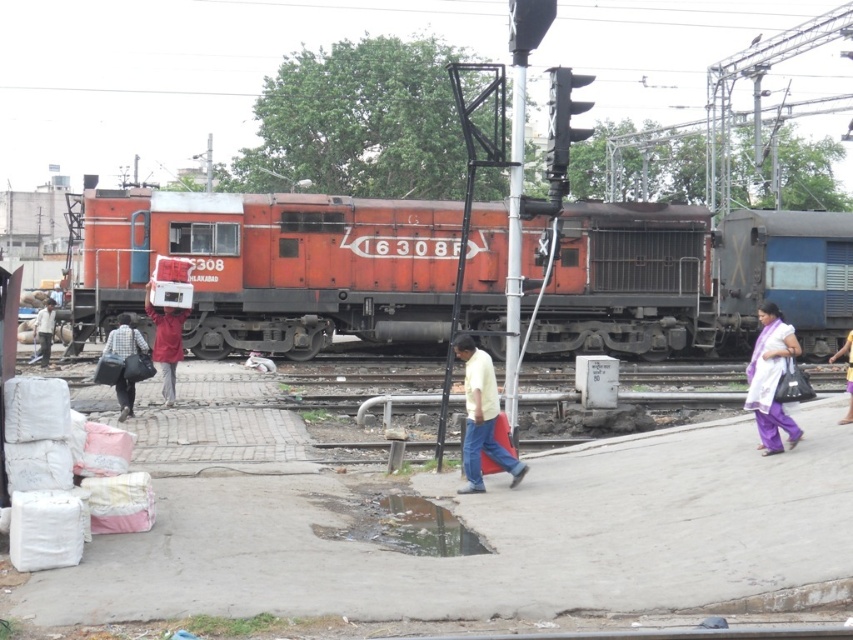
Is the position of light brown fabric bag at left more distant than that of purple fabric at lower right?

Yes.

Does point (51, 324) come farther from viewer compared to point (851, 396)?

Yes, it is.

Is point (44, 353) more distant than point (851, 358)?

Yes.

At what (x,y) coordinates should I click in order to perform the action: click on light brown fabric bag at left. Please return your answer as a coordinate pair (x, y). The image size is (853, 640). Looking at the image, I should click on (44, 332).

Who is positioned more to the left, yellow matte shirt at center or matte red jacket at center?

matte red jacket at center is more to the left.

Does yellow matte shirt at center come behind matte red jacket at center?

No.

Does point (509, 464) come behind point (155, 348)?

No.

The height and width of the screenshot is (640, 853). I want to click on yellow matte shirt at center, so click(480, 417).

Can you confirm if matte orange train at center is positioned to the right of plaid fabric shirt at center?

Incorrect, matte orange train at center is not on the right side of plaid fabric shirt at center.

Does point (583, 212) come behind point (126, 355)?

Yes, point (583, 212) is behind point (126, 355).

Where is `matte orange train at center`? matte orange train at center is located at coordinates (271, 266).